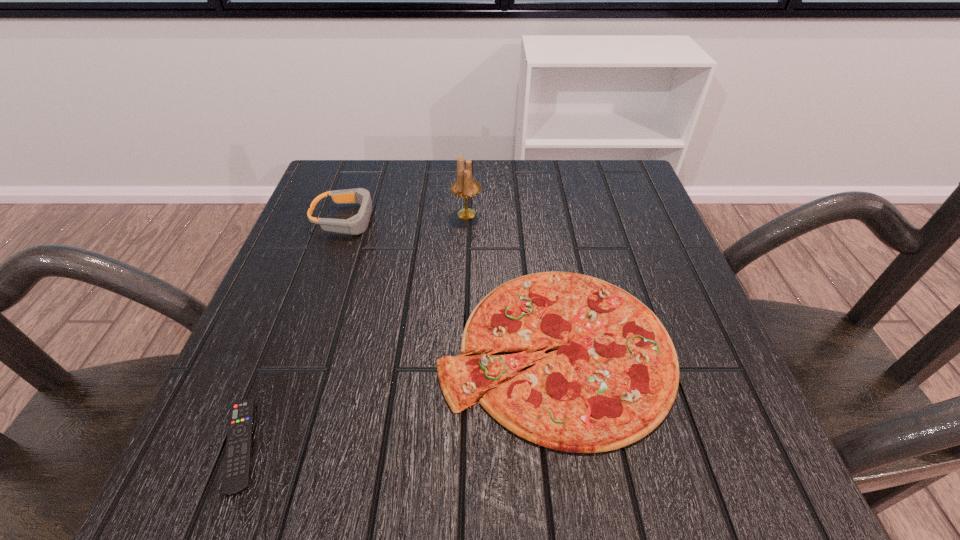
Find the location of a particular element. The width and height of the screenshot is (960, 540). free space at the left edge of the desktop is located at coordinates (331, 247).

Locate an element on the screen. This screenshot has width=960, height=540. free space at the right edge of the desktop is located at coordinates (684, 354).

At what (x,y) coordinates should I click in order to perform the action: click on vacant space at the far left corner of the desktop. Please return your answer as a coordinate pair (x, y). The height and width of the screenshot is (540, 960). Looking at the image, I should click on point(332,214).

Locate an element on the screen. Image resolution: width=960 pixels, height=540 pixels. vacant area that lies between the pizza and the shortest object is located at coordinates (397, 397).

In order to click on vacant area that lies between the third tallest object and the shortest object in this screenshot , I will do `click(397, 397)`.

The width and height of the screenshot is (960, 540). I want to click on vacant area between the third tallest object and the shortest object, so click(x=397, y=397).

You are a GUI agent. You are given a task and a screenshot of the screen. Output one action in this format:
    pyautogui.click(x=<x>, y=<y>)
    Task: Click on the vacant region between the shortest object and the goggles
    This screenshot has width=960, height=540.
    Given the screenshot: What is the action you would take?
    pos(294,332)

Point out which object is positioned as the third nearest to the second tallest object. Please provide its 2D coordinates. Your answer should be formatted as a tuple, i.e. [(x, y)], where the tuple contains the x and y coordinates of a point satisfying the conditions above.

[(237, 465)]

In order to click on object that is the third closest to the remote control in this screenshot , I will do point(465,186).

At what (x,y) coordinates should I click in order to perform the action: click on free space that satisfies the following two spatial constraints: 1. on the front and back of the second shortest object; 2. on the right side of the second tallest object. Please return your answer as a coordinate pair (x, y). The image size is (960, 540). Looking at the image, I should click on (301, 349).